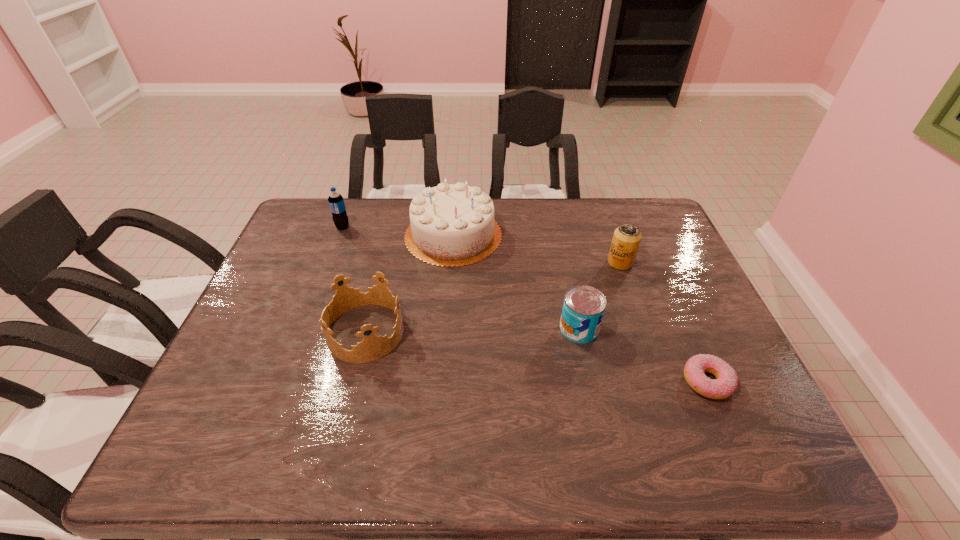
The image size is (960, 540). Identify the location of free region at the far edge of the desktop. point(396,239).

You are a GUI agent. You are given a task and a screenshot of the screen. Output one action in this format:
    pyautogui.click(x=<x>, y=<y>)
    Task: Click on the vacant space at the near edge of the desktop
    This screenshot has width=960, height=540.
    Given the screenshot: What is the action you would take?
    pyautogui.click(x=512, y=454)

Where is `vacant space at the left edge of the desktop`? Image resolution: width=960 pixels, height=540 pixels. vacant space at the left edge of the desktop is located at coordinates (270, 382).

Where is `vacant space at the right edge`? vacant space at the right edge is located at coordinates (678, 354).

Locate an element on the screen. This screenshot has width=960, height=540. vacant space at the far left corner is located at coordinates (321, 214).

Image resolution: width=960 pixels, height=540 pixels. Find the location of `vacant region at the near left corner of the desktop`. vacant region at the near left corner of the desktop is located at coordinates point(181,446).

Image resolution: width=960 pixels, height=540 pixels. Identify the location of vacant region at the near right corner of the desktop. click(757, 464).

In order to click on free space between the rightmost object and the tiara in this screenshot , I will do `click(536, 357)`.

Locate an element on the screen. This screenshot has height=540, width=960. free space between the fifth object from left to right and the tiara is located at coordinates pos(492,298).

Find the location of a particular element. empty space that is in between the tiara and the leftmost object is located at coordinates (353, 280).